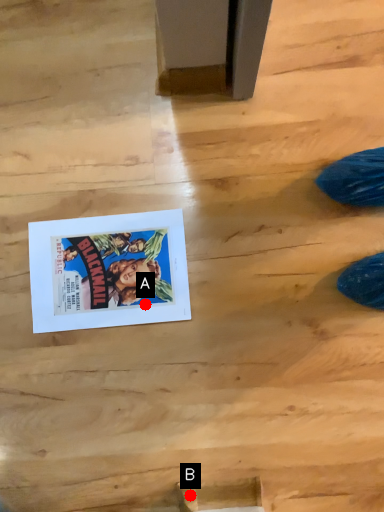
Question: Two points are circled on the image, labeled by A and B beside each circle. Which point appears closest to the camera in this image?

Choices:
 (A) A is closer
 (B) B is closer

Answer: (B)